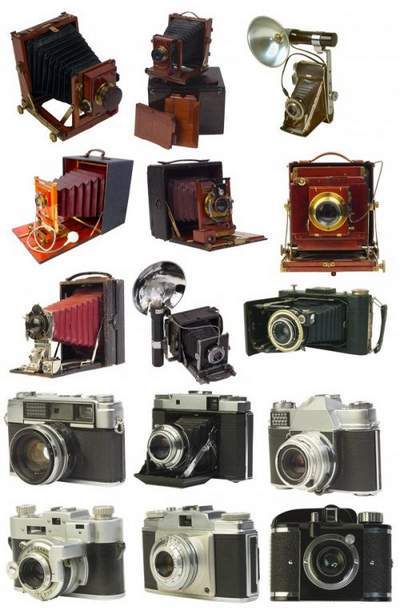
Where is `box`? box is located at coordinates (115, 329), (97, 88), (154, 178), (112, 196), (214, 102), (304, 171).